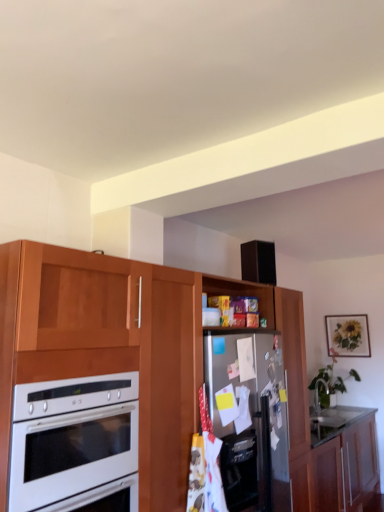
This screenshot has height=512, width=384. What do you see at coordinates (338, 466) in the screenshot?
I see `wooden cabinet at lower right, the second cabinetry positioned from the top` at bounding box center [338, 466].

In order to face stainless steel fridge at center, should I rotate leftwards or rightwards?

To align with it, rotate right about 5.259°.

The width and height of the screenshot is (384, 512). I want to click on wooden cabinet at center, which is the 1th cabinetry from top to bottom, so click(142, 356).

Does white glossy oven at left have a greater width compared to matte wooden picture frame at upper right?

Yes.

Can matte wooden picture frame at upper right be found inside white glossy oven at left?

No, matte wooden picture frame at upper right is located outside of white glossy oven at left.

Considering the relative sizes of white glossy oven at left and matte wooden picture frame at upper right in the image provided, is white glossy oven at left bigger than matte wooden picture frame at upper right?

Yes, white glossy oven at left is bigger than matte wooden picture frame at upper right.

Is white glossy oven at left to the right of matte wooden picture frame at upper right from the viewer's perspective?

In fact, white glossy oven at left is to the left of matte wooden picture frame at upper right.

Consider the image. Considering the sizes of objects white glossy oven at left and wooden cabinet at center, the 2th cabinetry ordered from the bottom, in the image provided, who is thinner, white glossy oven at left or wooden cabinet at center, the 2th cabinetry ordered from the bottom,?

With smaller width is white glossy oven at left.

Would you say white glossy oven at left contains wooden cabinet at center, the 2th cabinetry ordered from the bottom?

Actually, wooden cabinet at center, the 2th cabinetry ordered from the bottom, is outside white glossy oven at left.

Looking at this image, from a real-world perspective, is white glossy oven at left physically above wooden cabinet at center, which is the 1th cabinetry from top to bottom?

Yes, from a real-world perspective, white glossy oven at left is above wooden cabinet at center, which is the 1th cabinetry from top to bottom.

Is point (84, 424) farther from camera compared to point (173, 460)?

That is False.

Considering the positions of objects matte wooden picture frame at upper right and wooden cabinet at center, the 2th cabinetry ordered from the bottom, in the image provided, who is in front, matte wooden picture frame at upper right or wooden cabinet at center, the 2th cabinetry ordered from the bottom,?

wooden cabinet at center, the 2th cabinetry ordered from the bottom, is in front.

Can you tell me how much matte wooden picture frame at upper right and wooden cabinet at center, the 2th cabinetry ordered from the bottom, differ in facing direction?

The angle between the facing direction of matte wooden picture frame at upper right and the facing direction of wooden cabinet at center, the 2th cabinetry ordered from the bottom, is 89 degrees.

From a real-world perspective, who is located lower, matte wooden picture frame at upper right or wooden cabinet at center, which is the 1th cabinetry from top to bottom?

From a 3D spatial view, wooden cabinet at center, which is the 1th cabinetry from top to bottom, is below.

Can white glossy oven at left be found inside wooden cabinet at lower right, the second cabinetry positioned from the top?

That's incorrect, white glossy oven at left is not inside wooden cabinet at lower right, the second cabinetry positioned from the top.

Between point (348, 499) and point (52, 424), which one is positioned in front?

The point (52, 424) is closer to the camera.

From the picture: Considering the relative sizes of wooden cabinet at lower right, which ranks as the first cabinetry in bottom-to-top order, and white glossy oven at left in the image provided, is wooden cabinet at lower right, which ranks as the first cabinetry in bottom-to-top order, wider than white glossy oven at left?

Yes.

From the image's perspective, which one is positioned lower, wooden cabinet at lower right, the second cabinetry positioned from the top, or white glossy oven at left?

wooden cabinet at lower right, the second cabinetry positioned from the top.

Is wooden cabinet at lower right, which ranks as the first cabinetry in bottom-to-top order, outside of wooden cabinet at center, the 2th cabinetry ordered from the bottom?

No, wooden cabinet at lower right, which ranks as the first cabinetry in bottom-to-top order, is inside or overlapping with wooden cabinet at center, the 2th cabinetry ordered from the bottom.

Considering the relative sizes of wooden cabinet at lower right, which ranks as the first cabinetry in bottom-to-top order, and wooden cabinet at center, the 2th cabinetry ordered from the bottom, in the image provided, is wooden cabinet at lower right, which ranks as the first cabinetry in bottom-to-top order, wider than wooden cabinet at center, the 2th cabinetry ordered from the bottom,?

No.

Considering the relative sizes of wooden cabinet at lower right, which ranks as the first cabinetry in bottom-to-top order, and wooden cabinet at center, which is the 1th cabinetry from top to bottom, in the image provided, is wooden cabinet at lower right, which ranks as the first cabinetry in bottom-to-top order, shorter than wooden cabinet at center, which is the 1th cabinetry from top to bottom,?

Yes, wooden cabinet at lower right, which ranks as the first cabinetry in bottom-to-top order, is shorter than wooden cabinet at center, which is the 1th cabinetry from top to bottom.

Is wooden cabinet at lower right, which ranks as the first cabinetry in bottom-to-top order, aimed at wooden cabinet at center, the 2th cabinetry ordered from the bottom?

Yes, wooden cabinet at lower right, which ranks as the first cabinetry in bottom-to-top order, is aimed at wooden cabinet at center, the 2th cabinetry ordered from the bottom.

Looking at this image, from a real-world perspective, between wooden cabinet at lower right, which ranks as the first cabinetry in bottom-to-top order, and matte wooden picture frame at upper right, who is vertically higher?

matte wooden picture frame at upper right, from a real-world perspective.

In the scene shown: Between wooden cabinet at lower right, which ranks as the first cabinetry in bottom-to-top order, and matte wooden picture frame at upper right, which one is positioned behind?

matte wooden picture frame at upper right is further away from the camera.

How different are the orientations of wooden cabinet at lower right, the second cabinetry positioned from the top, and matte wooden picture frame at upper right in degrees?

They differ by 88.5 degrees in their facing directions.

Which is nearer, (335, 511) or (367, 347)?

The point (335, 511) is more forward.

Does point (237, 495) lie behind point (345, 422)?

No.

Considering the relative positions of stainless steel fridge at center and wooden cabinet at lower right, the second cabinetry positioned from the top, in the image provided, is stainless steel fridge at center to the right of wooden cabinet at lower right, the second cabinetry positioned from the top, from the viewer's perspective?

No, stainless steel fridge at center is not to the right of wooden cabinet at lower right, the second cabinetry positioned from the top.

Considering the sizes of objects stainless steel fridge at center and wooden cabinet at lower right, which ranks as the first cabinetry in bottom-to-top order, in the image provided, who is thinner, stainless steel fridge at center or wooden cabinet at lower right, which ranks as the first cabinetry in bottom-to-top order,?

With smaller width is stainless steel fridge at center.

From the image's perspective, is stainless steel fridge at center beneath wooden cabinet at lower right, the second cabinetry positioned from the top?

Incorrect, from the image's perspective, stainless steel fridge at center is higher than wooden cabinet at lower right, the second cabinetry positioned from the top.

What are the coordinates of `oven in front of the matte wooden picture frame at upper right` in the screenshot? It's located at (75, 444).

Locate an element on the screen. The image size is (384, 512). oven that appears above the wooden cabinet at center, which is the 1th cabinetry from top to bottom (from a real-world perspective) is located at coordinates (75, 444).

From the image, which object appears to be farther from wooden cabinet at center, the 2th cabinetry ordered from the bottom, wooden cabinet at lower right, which ranks as the first cabinetry in bottom-to-top order, or stainless steel fridge at center?

Based on the image, wooden cabinet at lower right, which ranks as the first cabinetry in bottom-to-top order, appears to be further to wooden cabinet at center, the 2th cabinetry ordered from the bottom.

Based on their spatial positions, is wooden cabinet at center, the 2th cabinetry ordered from the bottom, or wooden cabinet at lower right, the second cabinetry positioned from the top, further from matte wooden picture frame at upper right?

wooden cabinet at center, the 2th cabinetry ordered from the bottom.

Based on their spatial positions, is stainless steel fridge at center or wooden cabinet at center, which is the 1th cabinetry from top to bottom, closer to matte wooden picture frame at upper right?

wooden cabinet at center, which is the 1th cabinetry from top to bottom.

Based on their spatial positions, is wooden cabinet at center, the 2th cabinetry ordered from the bottom, or matte wooden picture frame at upper right closer to wooden cabinet at lower right, the second cabinetry positioned from the top?

wooden cabinet at center, the 2th cabinetry ordered from the bottom.

Which object lies further to the anchor point stainless steel fridge at center, white glossy oven at left or matte wooden picture frame at upper right?

The object further to stainless steel fridge at center is matte wooden picture frame at upper right.

Which object lies nearer to the anchor point wooden cabinet at center, which is the 1th cabinetry from top to bottom, white glossy oven at left or stainless steel fridge at center?

white glossy oven at left lies closer to wooden cabinet at center, which is the 1th cabinetry from top to bottom, than the other object.

Which object lies further to the anchor point wooden cabinet at center, the 2th cabinetry ordered from the bottom, stainless steel fridge at center or matte wooden picture frame at upper right?

The object further to wooden cabinet at center, the 2th cabinetry ordered from the bottom, is matte wooden picture frame at upper right.

From the image, which object appears to be farther from wooden cabinet at center, the 2th cabinetry ordered from the bottom, wooden cabinet at lower right, the second cabinetry positioned from the top, or matte wooden picture frame at upper right?

matte wooden picture frame at upper right is further to wooden cabinet at center, the 2th cabinetry ordered from the bottom.

Locate an element on the screen. refrigerator between wooden cabinet at center, which is the 1th cabinetry from top to bottom, and matte wooden picture frame at upper right from front to back is located at coordinates (249, 415).

Find the location of a particular element. oven between wooden cabinet at center, which is the 1th cabinetry from top to bottom, and matte wooden picture frame at upper right from front to back is located at coordinates (75, 444).

This screenshot has height=512, width=384. I want to click on refrigerator located between white glossy oven at left and matte wooden picture frame at upper right in the depth direction, so click(x=249, y=415).

Image resolution: width=384 pixels, height=512 pixels. I want to click on cabinetry positioned between wooden cabinet at center, which is the 1th cabinetry from top to bottom, and matte wooden picture frame at upper right from near to far, so click(338, 466).